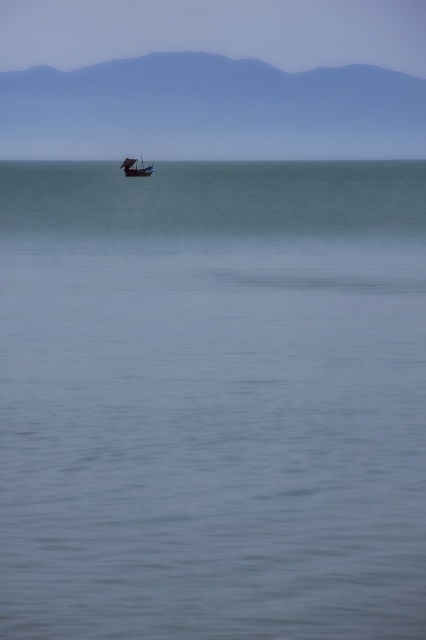
Question: Does blue smooth water at center have a larger size compared to wooden boat at center?

Choices:
 (A) yes
 (B) no

Answer: (A)

Question: Can you confirm if blue smooth water at center is wider than wooden boat at center?

Choices:
 (A) yes
 (B) no

Answer: (A)

Question: Which of the following is the closest to the observer?

Choices:
 (A) (x=134, y=161)
 (B) (x=281, y=225)

Answer: (B)

Question: Does blue smooth water at center appear under wooden boat at center?

Choices:
 (A) yes
 (B) no

Answer: (A)